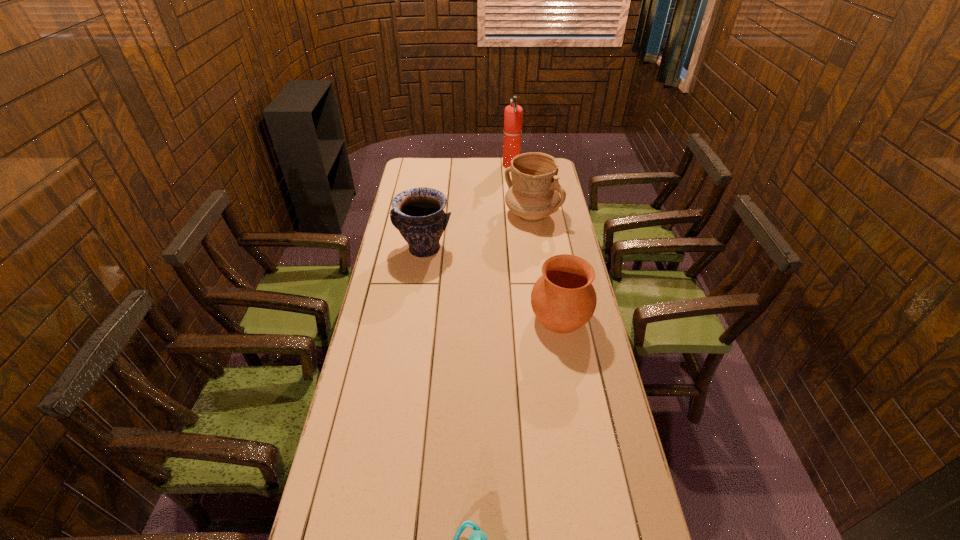
Where is `fire extinguisher`? The height and width of the screenshot is (540, 960). fire extinguisher is located at coordinates (513, 114).

The width and height of the screenshot is (960, 540). I want to click on the tallest object, so click(x=513, y=114).

This screenshot has height=540, width=960. I want to click on the farthest pottery, so click(x=533, y=194).

The image size is (960, 540). Find the location of `the third farthest object`. the third farthest object is located at coordinates (417, 213).

Locate an element on the screen. The width and height of the screenshot is (960, 540). the second nearest pottery is located at coordinates (417, 213).

Locate an element on the screen. This screenshot has height=540, width=960. the nearest pottery is located at coordinates (563, 299).

Where is `vacant area located 0.400m with the nozzle and gauge on the fire extinguisher`? vacant area located 0.400m with the nozzle and gauge on the fire extinguisher is located at coordinates (426, 166).

Locate an element on the screen. The height and width of the screenshot is (540, 960). free space located 0.200m with the nozzle and gauge on the fire extinguisher is located at coordinates (465, 166).

The width and height of the screenshot is (960, 540). I want to click on free space located 0.330m with the nozzle and gauge on the fire extinguisher, so click(x=440, y=166).

At what (x,y) coordinates should I click in order to perform the action: click on vacant space situated 0.330m on the front of the farthest pottery. Please return your answer as a coordinate pair (x, y). Looking at the image, I should click on (541, 283).